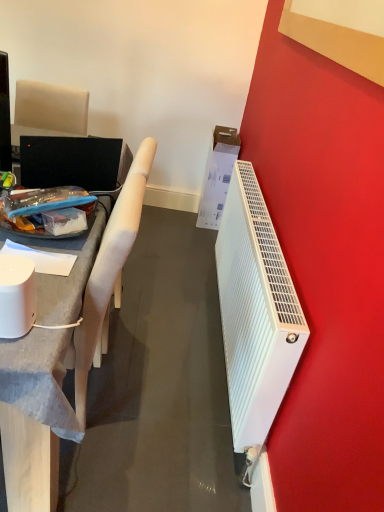
Question: Should I look upward or downward to see white plastic radiator at right?

Choices:
 (A) down
 (B) up

Answer: (A)

Question: Is white fabric chair at left inside white cardboard box at right?

Choices:
 (A) no
 (B) yes

Answer: (A)

Question: Does white cardboard box at right appear on the left side of white fabric chair at left?

Choices:
 (A) yes
 (B) no

Answer: (B)

Question: Is white cardboard box at right taller than white fabric chair at left?

Choices:
 (A) no
 (B) yes

Answer: (A)

Question: From the image's perspective, is white cardboard box at right on top of white fabric chair at left?

Choices:
 (A) yes
 (B) no

Answer: (A)

Question: Would you say white cardboard box at right is outside white fabric chair at left?

Choices:
 (A) no
 (B) yes

Answer: (B)

Question: Can you confirm if white cardboard box at right is shorter than white fabric chair at left?

Choices:
 (A) yes
 (B) no

Answer: (A)

Question: Can you confirm if white cardboard box at right is smaller than white plastic radiator at right?

Choices:
 (A) no
 (B) yes

Answer: (B)

Question: Is white cardboard box at right oriented towards white plastic radiator at right?

Choices:
 (A) no
 (B) yes

Answer: (B)

Question: Is white cardboard box at right shorter than white plastic radiator at right?

Choices:
 (A) yes
 (B) no

Answer: (B)

Question: From the image's perspective, is white cardboard box at right beneath white plastic radiator at right?

Choices:
 (A) yes
 (B) no

Answer: (B)

Question: From the image's perspective, is white cardboard box at right located above white plastic radiator at right?

Choices:
 (A) no
 (B) yes

Answer: (B)

Question: Is white cardboard box at right far away from white plastic radiator at right?

Choices:
 (A) yes
 (B) no

Answer: (B)

Question: From a real-world perspective, is matte gray desk at left located higher than white fabric chair at left?

Choices:
 (A) no
 (B) yes

Answer: (A)